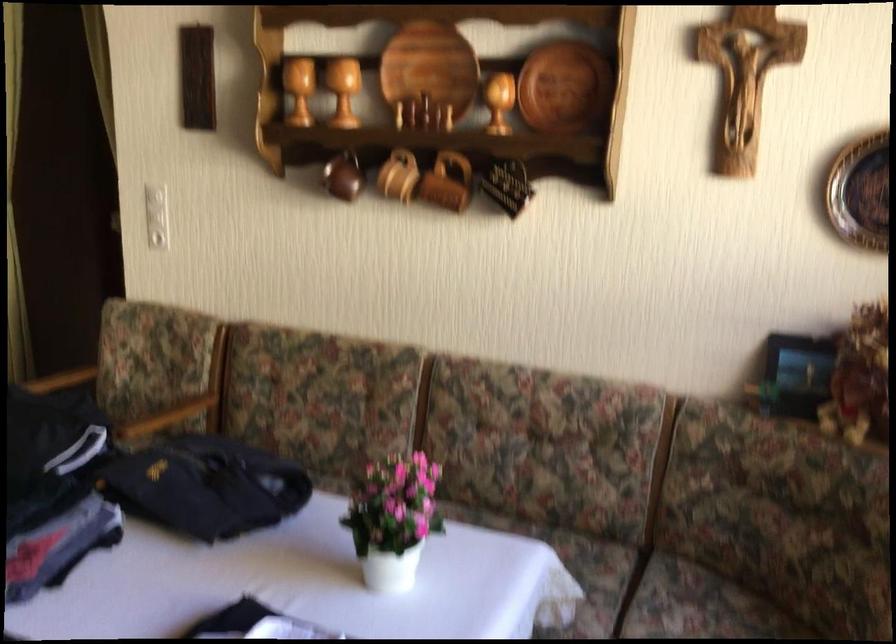
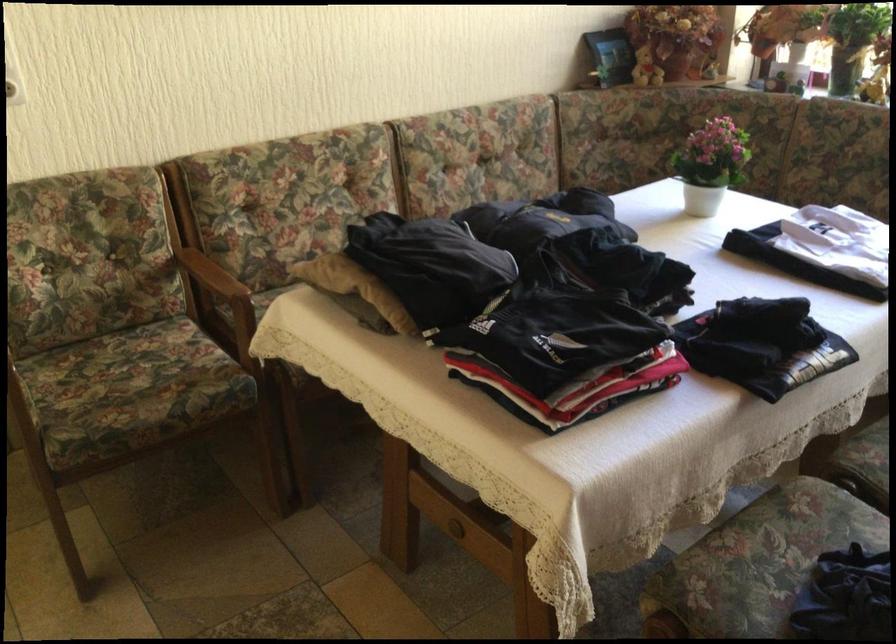
In the second image, find the point that corresponds to [178,404] in the first image.

(204, 269)